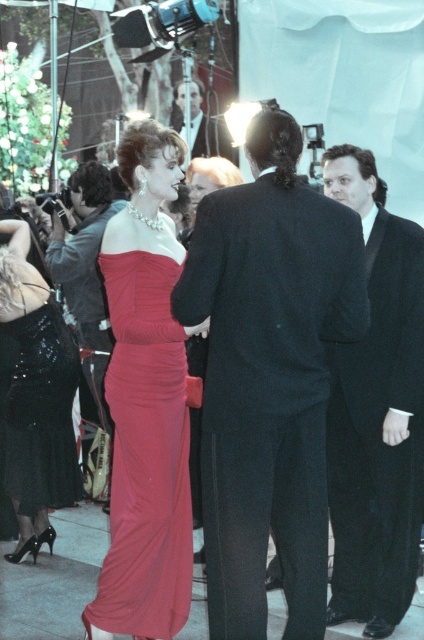
Is point (409, 509) closer to camera compared to point (113, 605)?

No, (409, 509) is further to viewer.

Does black satin suit at right have a smaller size compared to satin red dress at center?

No.

Measure the distance between point (398, 232) and camera.

Point (398, 232) and camera are 4.36 meters apart from each other.

Locate an element on the screen. The width and height of the screenshot is (424, 640). black satin suit at right is located at coordinates (376, 412).

Locate an element on the screen. The width and height of the screenshot is (424, 640). black wool suit at center is located at coordinates (268, 376).

Who is more distant from viewer, [217,477] or [72,262]?

The point [72,262] is behind.

Locate an element on the screen. black wool suit at center is located at coordinates pos(268,376).

Is black satin suit at right smaller than smooth black suit at center?

Actually, black satin suit at right might be larger than smooth black suit at center.

Is point (365, 625) closer to viewer compared to point (184, 100)?

Yes, point (365, 625) is closer to viewer.

Identify the location of black satin suit at right. The height and width of the screenshot is (640, 424). (376, 412).